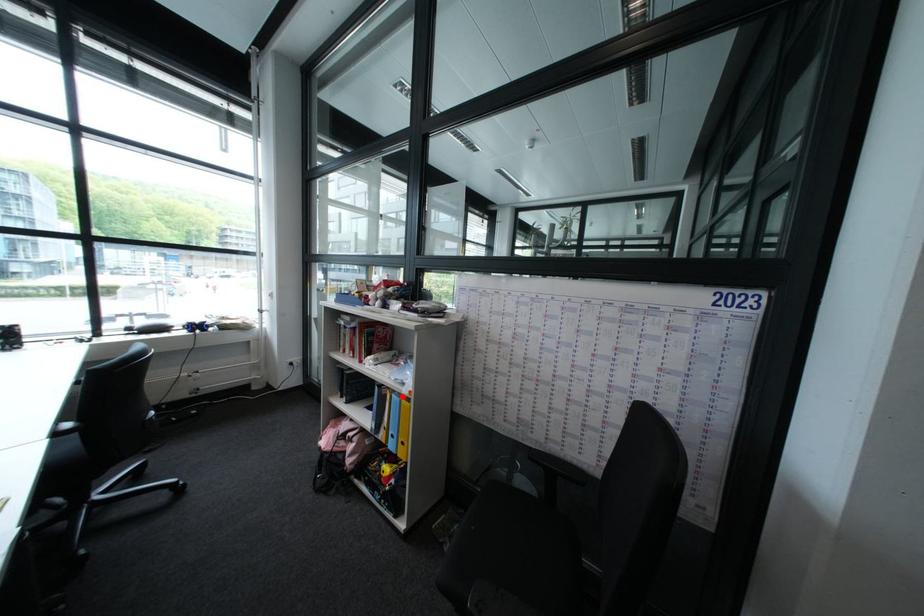
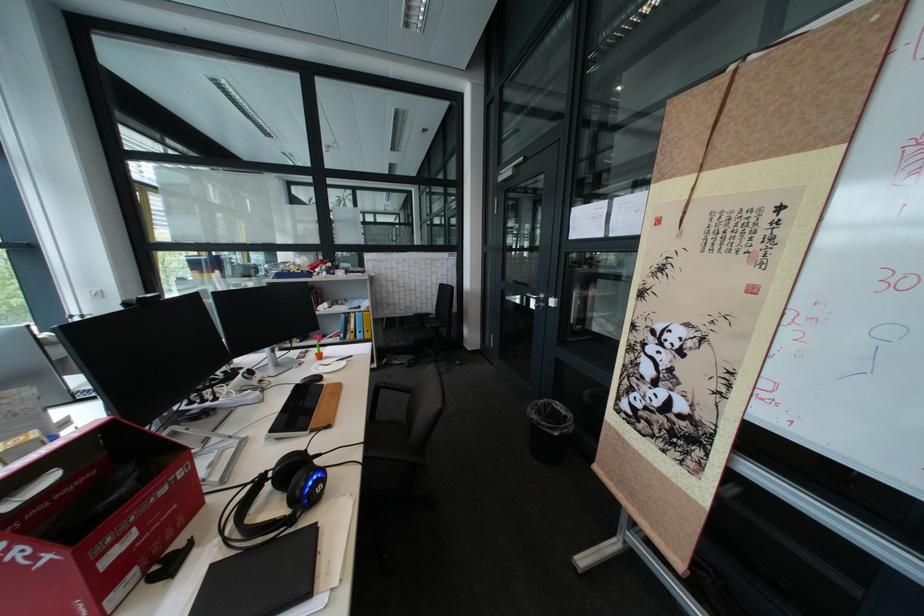
Locate, in the second image, the point that corresponds to the highlighted location in the first image.

(367, 315)